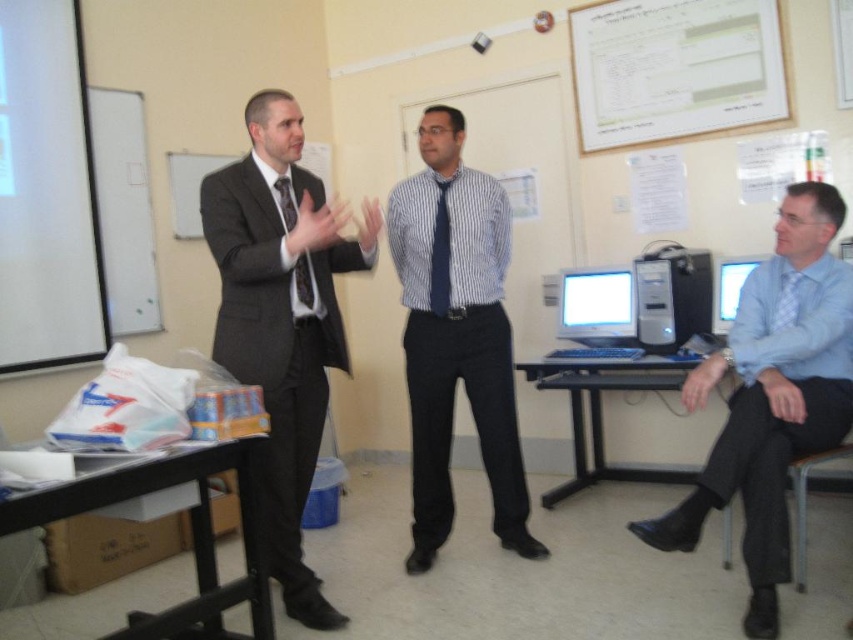
You are a student who needs to reach the matte black monitor at center from your current position near the light blue shirt at right. Can you comfortably walk to it without needing to move any furniture?

The distance between the light blue shirt at right and the matte black monitor at center is 35.81 inches. Since this distance is relatively short, you can comfortably walk to the matte black monitor at center without needing to move any furniture.

You are a student sitting at the back of the classroom. You notice two objects in the scene. Which one is wider, the light blue shirt at right or the matte black monitor at center?

The light blue shirt at right is wider than the matte black monitor at center according to the description.